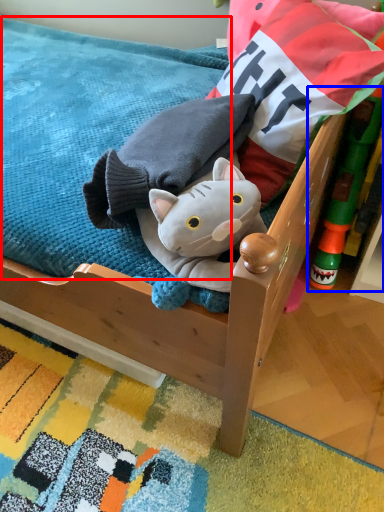
Question: Which object is further to the camera taking this photo, mattress (highlighted by a red box) or toy (highlighted by a blue box)?

Choices:
 (A) mattress
 (B) toy

Answer: (B)